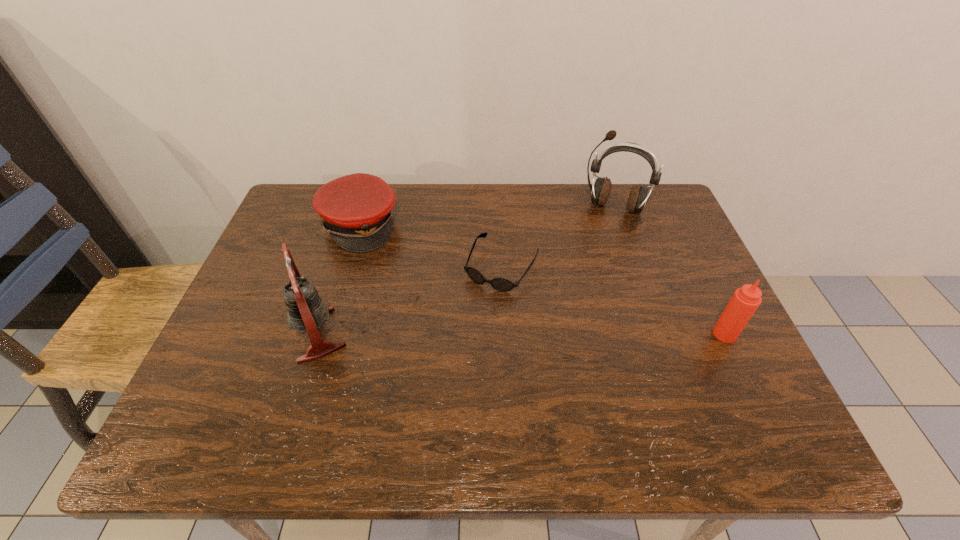
Locate an element on the screen. This screenshot has height=540, width=960. free space on the desktop that is between the bell and the third tallest object and is positioned on the lenses of the sunglasses is located at coordinates (461, 334).

The width and height of the screenshot is (960, 540). In order to click on free space on the desktop that is between the bell and the third tallest object and is positioned on the ear pads of the fourth object from left to right in this screenshot , I will do 576,334.

Identify the location of free space on the desktop that is between the bell and the Tabasco sauce and is positioned on the front of the cap with an emblem. The image size is (960, 540). (480, 334).